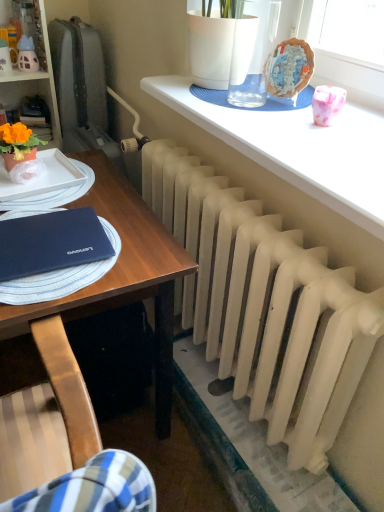
What are the coordinates of `vacant area that is situated to the right of orange matte flower pot at left` in the screenshot? It's located at (66, 175).